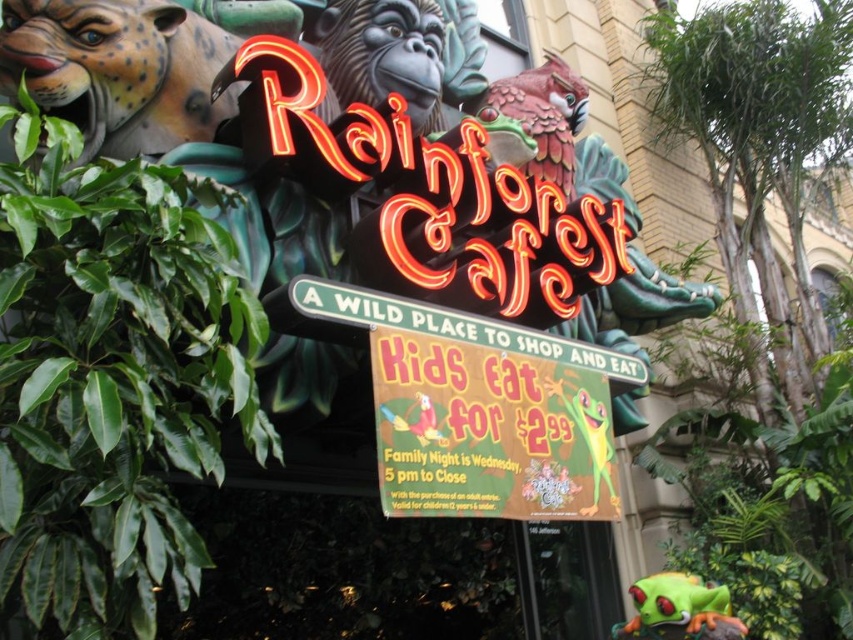
You are a customer entering the Rainforest Cafe and see the bright yellow paper sign at center and the green matte frog at center. Which object is taller?

The bright yellow paper sign at center is taller than the green matte frog at center.

You are a customer entering the Rainforest Cafe and notice two animals on the entrance sign. The shiny metallic parrot at upper center and the green matte frog at center. Which animal is bigger in size?

The shiny metallic parrot at upper center is larger in size compared to the green matte frog at center.

You are a customer entering the Rainforest Cafe and see the bright yellow paper sign at center and the shiny metallic parrot at upper center. Which object is larger in size?

The shiny metallic parrot at upper center is larger in size compared to the bright yellow paper sign at center.